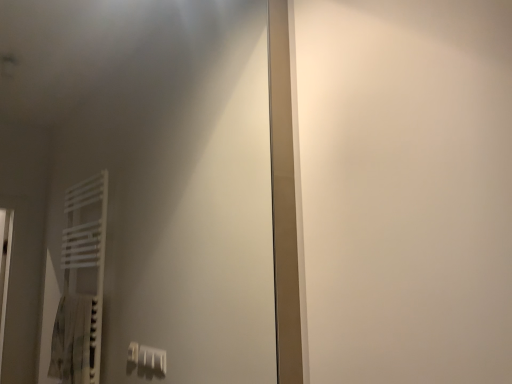
Question: Should I look upward or downward to see white glossy mirror at upper left?

Choices:
 (A) down
 (B) up

Answer: (B)